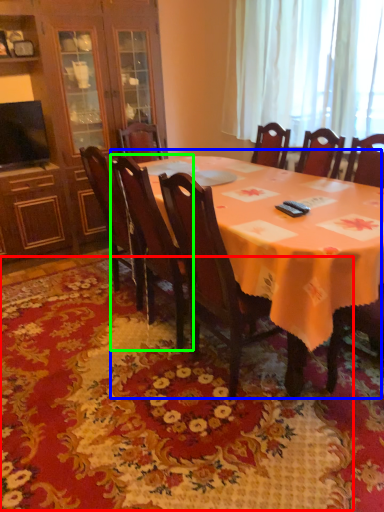
Question: Considering the real-world distances, which object is farthest from mat (highlighted by a red box)? kitchen & dining room table (highlighted by a blue box) or chair (highlighted by a green box)?

Choices:
 (A) kitchen & dining room table
 (B) chair

Answer: (A)